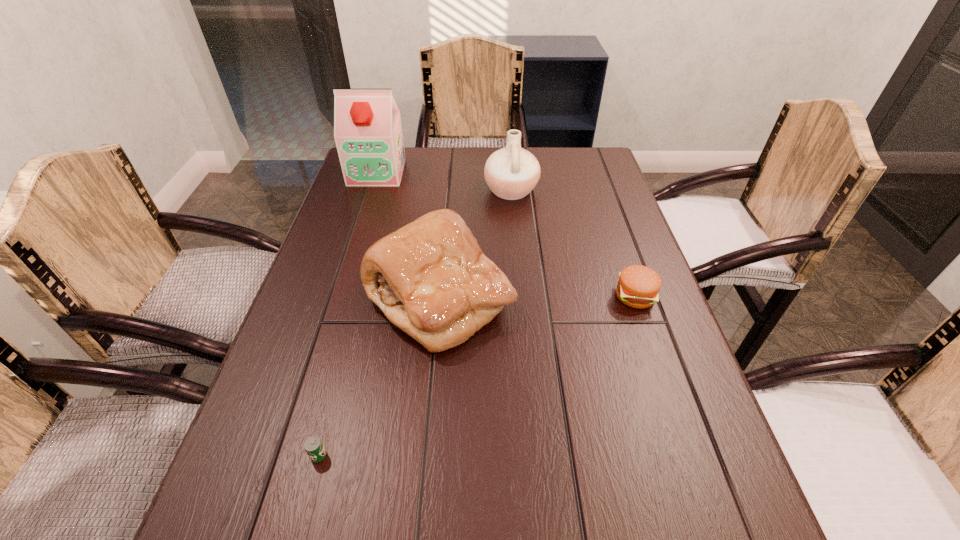
The height and width of the screenshot is (540, 960). I want to click on vacant space located to pour from the handle of the pottery, so click(x=398, y=190).

At what (x,y) coordinates should I click in order to perform the action: click on vacant point located on the filling side of the bread. Please return your answer as a coordinate pair (x, y). This screenshot has height=540, width=960. Looking at the image, I should click on tap(566, 299).

Where is `free spot located on the left of the rightmost object`? free spot located on the left of the rightmost object is located at coordinates (460, 296).

Image resolution: width=960 pixels, height=540 pixels. I want to click on free spot located 0.130m on the back of the beer can, so click(342, 368).

Locate an element on the screen. This screenshot has width=960, height=540. soya milk present at the far edge is located at coordinates tap(368, 134).

What are the coordinates of `pottery at the far edge` in the screenshot? It's located at (511, 173).

Locate an element on the screen. soya milk that is at the left edge is located at coordinates (368, 134).

Identify the location of bread at the left edge. (430, 278).

You are a GUI agent. You are given a task and a screenshot of the screen. Output one action in this format:
    pyautogui.click(x=<x>, y=<y>)
    Task: Click on the beer can that is at the left edge
    
    Given the screenshot: What is the action you would take?
    pyautogui.click(x=314, y=447)

You are a GUI agent. You are given a task and a screenshot of the screen. Output one action in this format:
    pyautogui.click(x=<x>, y=<y>)
    Task: Click on the object at the right edge
    This screenshot has height=540, width=960.
    Given the screenshot: What is the action you would take?
    coord(638,286)